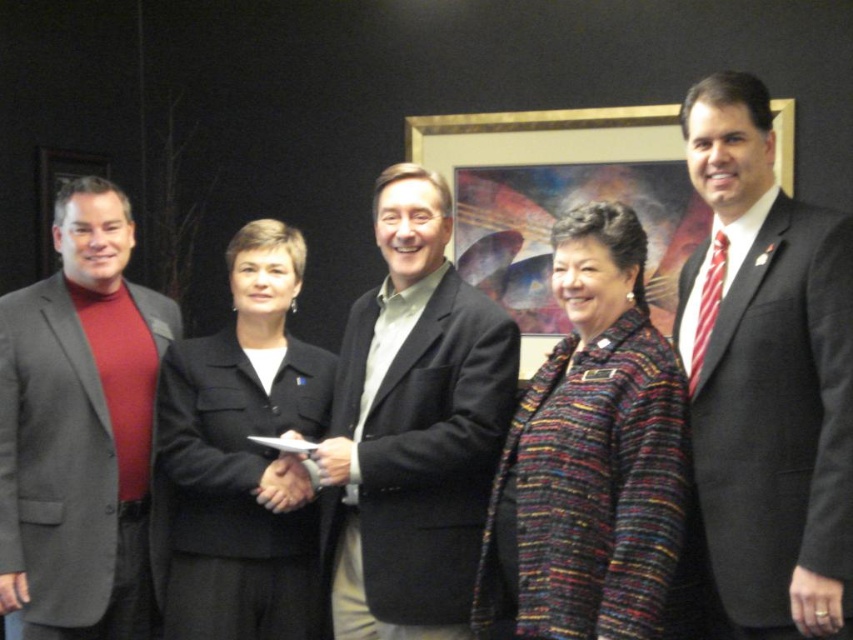
Question: Can you confirm if matte black suit at right is positioned to the right of gold-framed picture at center?

Choices:
 (A) no
 (B) yes

Answer: (B)

Question: Can you confirm if matte gray blazer at left is wider than black fabric coat at center?

Choices:
 (A) no
 (B) yes

Answer: (A)

Question: In this image, where is dark gray suit at center located relative to gold-framed picture at center?

Choices:
 (A) above
 (B) below

Answer: (B)

Question: Among these objects, which one is nearest to the camera?

Choices:
 (A) multicolored tweed jacket at center
 (B) black fabric coat at center
 (C) dark gray suit at center
 (D) gold-framed picture at center

Answer: (A)

Question: Among these objects, which one is farthest from the camera?

Choices:
 (A) matte black suit at right
 (B) dark gray suit at center
 (C) black fabric coat at center

Answer: (C)

Question: Which point is farther to the camera?

Choices:
 (A) (120, 627)
 (B) (198, 342)
 (C) (535, 432)

Answer: (B)